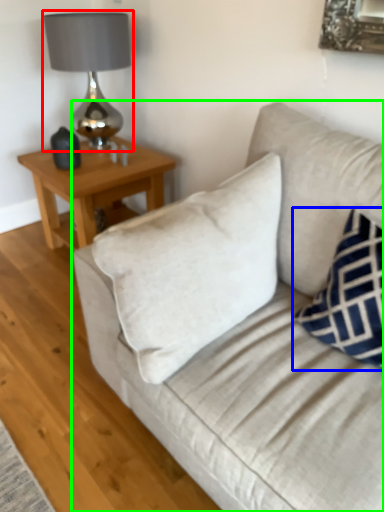
Question: Based on their relative distances, which object is nearer to table lamp (highlighted by a red box)? Choose from pillow (highlighted by a blue box) and studio couch (highlighted by a green box).

Choices:
 (A) pillow
 (B) studio couch

Answer: (B)